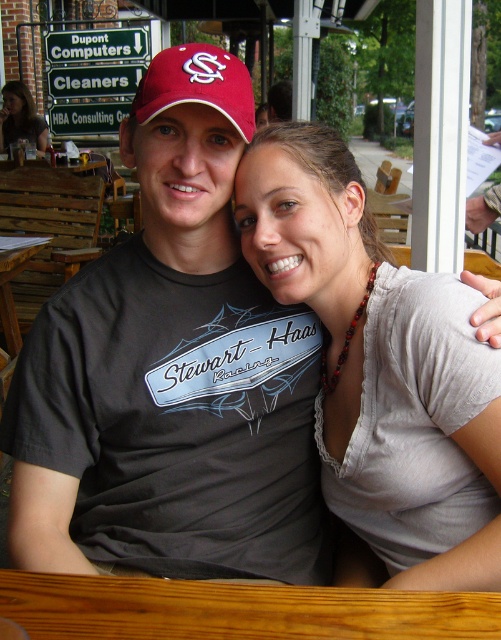
Can you confirm if matte red baseball cap at upper center is thinner than brown wooden table at lower left?

No, matte red baseball cap at upper center is not thinner than brown wooden table at lower left.

Which is in front, point (178, 64) or point (11, 307)?

Point (178, 64) is more forward.

At what (x,y) coordinates should I click in order to perform the action: click on matte red baseball cap at upper center. Please return your answer as a coordinate pair (x, y). This screenshot has height=640, width=501. Looking at the image, I should click on (196, 84).

Is matte gray shirt at center smaller than brown wooden table at lower left?

No.

Between matte gray shirt at center and brown wooden table at lower left, which one appears on the left side from the viewer's perspective?

brown wooden table at lower left

Which is in front, point (349, 221) or point (10, 268)?

Point (349, 221) is more forward.

Where is `matte gray shirt at center`? The image size is (501, 640). matte gray shirt at center is located at coordinates (375, 355).

Which is behind, point (268, 161) or point (241, 97)?

Positioned behind is point (268, 161).

Can you confirm if matte gray shirt at center is taller than matte red baseball cap at upper center?

Indeed, matte gray shirt at center has a greater height compared to matte red baseball cap at upper center.

The image size is (501, 640). What are the coordinates of `matte gray shirt at center` in the screenshot? It's located at (375, 355).